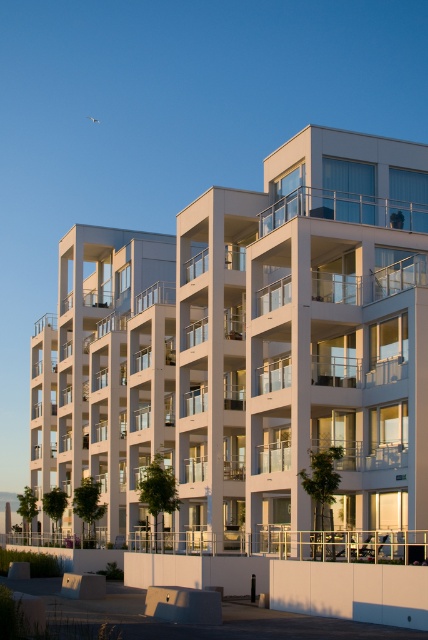
Looking at this image, can you confirm if white smooth building at center is bigger than clear glass balcony at upper center?

Correct, white smooth building at center is larger in size than clear glass balcony at upper center.

Between white smooth building at center and clear glass balcony at upper center, which one appears on the left side from the viewer's perspective?

Positioned to the left is white smooth building at center.

Is point (386, 419) farther from camera compared to point (416, 216)?

No, it is in front of (416, 216).

This screenshot has height=640, width=428. I want to click on white smooth building at center, so click(x=252, y=356).